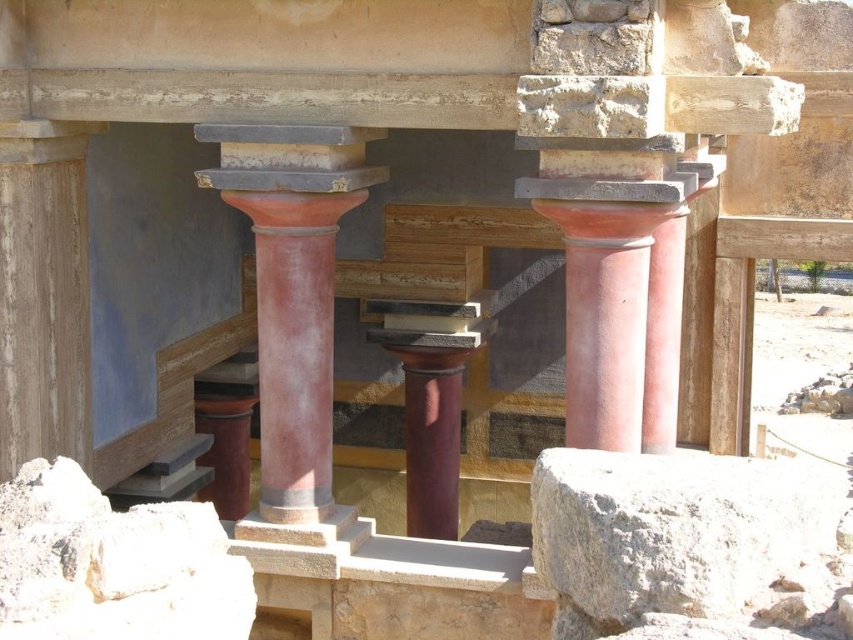
Question: Can you confirm if gray rough stone at lower right is thinner than matte terracotta column at center?

Choices:
 (A) yes
 (B) no

Answer: (B)

Question: Can you confirm if gray rough stone at lower right is wider than matte terracotta column at center?

Choices:
 (A) no
 (B) yes

Answer: (B)

Question: Which point appears farthest from the camera in this image?

Choices:
 (A) (289, 518)
 (B) (531, 492)

Answer: (A)

Question: Does gray rough stone at lower right appear under matte terracotta column at center?

Choices:
 (A) no
 (B) yes

Answer: (B)

Question: Which point appears closest to the camera in this image?

Choices:
 (A) (282, 416)
 (B) (756, 566)

Answer: (B)

Question: Which object is farther from the camera taking this photo?

Choices:
 (A) matte terracotta column at center
 (B) gray rough stone at lower right

Answer: (A)